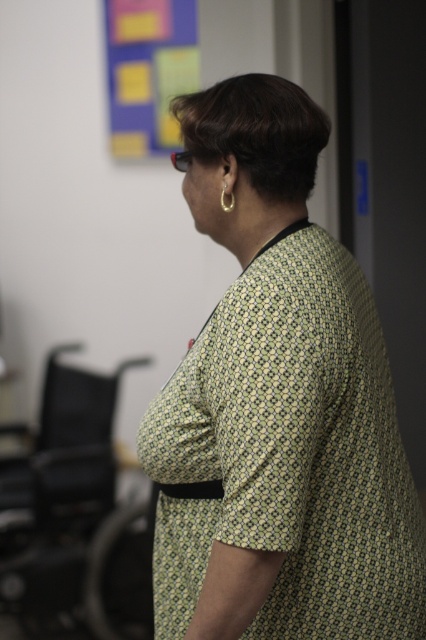
Question: Is green printed dress at center positioned behind black plastic swivel chair at left?

Choices:
 (A) no
 (B) yes

Answer: (A)

Question: Considering the real-world distances, which object is closest to the multicolored paper at upper left?

Choices:
 (A) green printed dress at center
 (B) gold metallic hoop at upper right

Answer: (A)

Question: Among these objects, which one is farthest from the camera?

Choices:
 (A) green printed dress at center
 (B) multicolored paper at upper left

Answer: (B)

Question: Is green printed dress at center smaller than multicolored paper at upper left?

Choices:
 (A) no
 (B) yes

Answer: (A)

Question: Does black plastic swivel chair at left come in front of gold metallic hoop at upper right?

Choices:
 (A) yes
 (B) no

Answer: (B)

Question: Which of the following is the farthest from the observer?

Choices:
 (A) black plastic swivel chair at left
 (B) green printed dress at center
 (C) gold metallic hoop at upper right

Answer: (A)